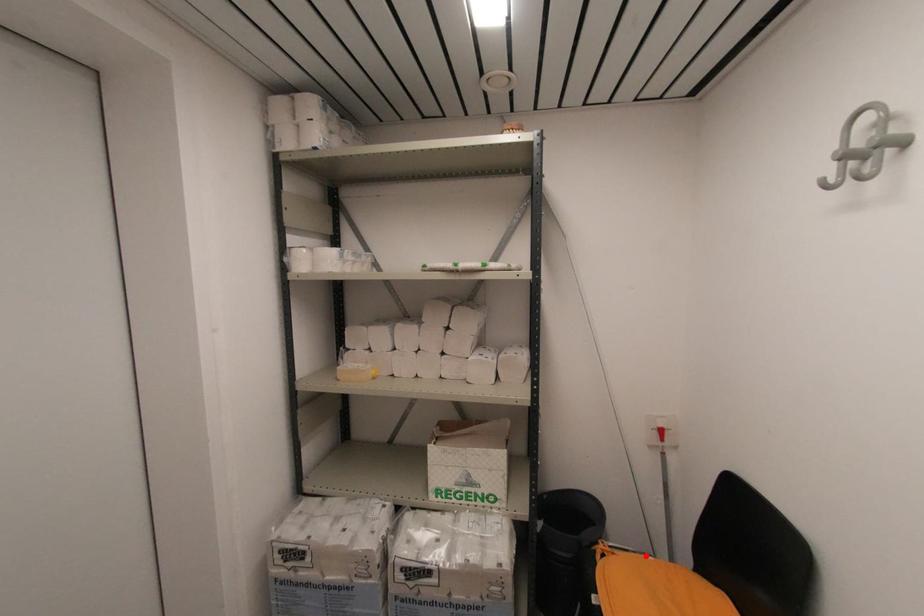
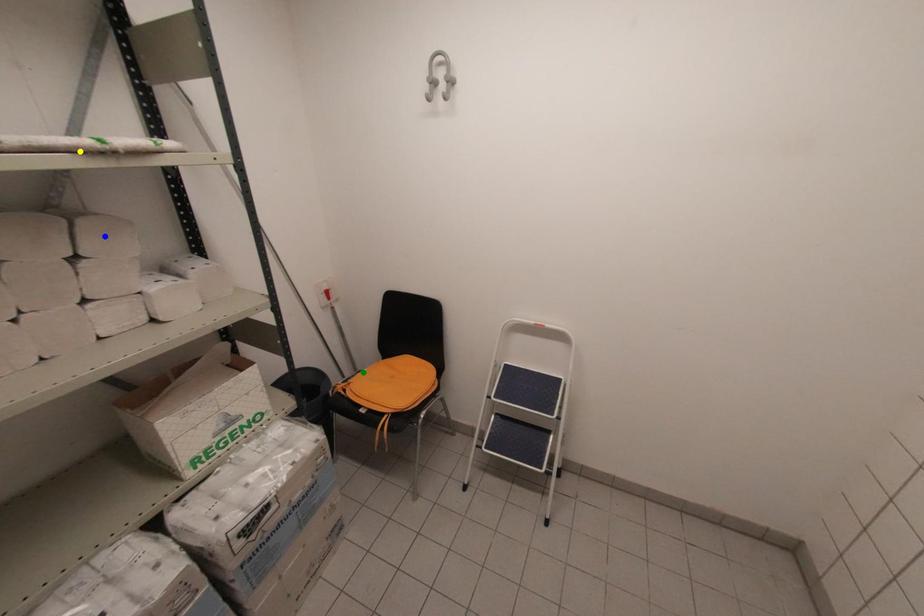
Question: I am providing you with two images of the same scene from different viewpoints. A red point is marked on the first image. You are given multiple points on the second image. In image 2, which mark is for the same physical point as the one in image 1?

Choices:
 (A) yellow point
 (B) blue point
 (C) green point

Answer: (C)